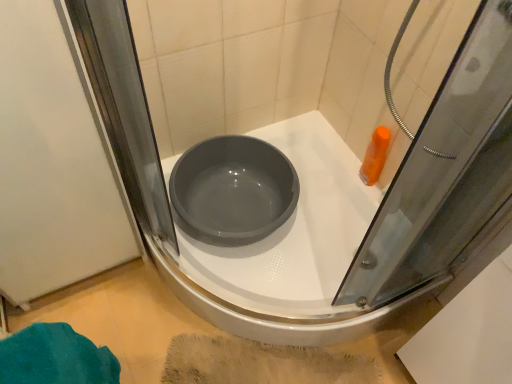
The image size is (512, 384). Describe the element at coordinates (295, 230) in the screenshot. I see `matte gray bath at center` at that location.

Find the location of a particular element. Image resolution: width=512 pixels, height=384 pixels. matte gray bath at center is located at coordinates (295, 230).

In order to face matte gray bath at center, should I rotate leftwards or rightwards?

You should look left and rotate roughly 2.578 degrees.

I want to click on matte gray bath at center, so click(x=295, y=230).